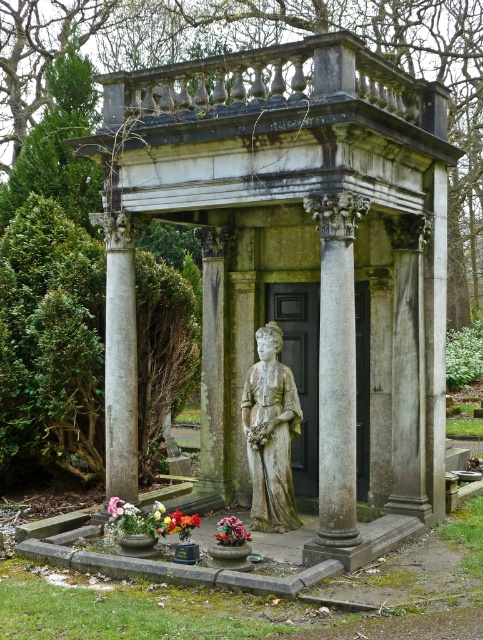
You are an architect examining the classical mausoleum. The mausoleum has a symmetrical design with columns. Where is the smooth stone column at center positioned in relation to the mausoleum?

The smooth stone column at center is positioned at point coordinates of 0.558 on the x and 0.248 on the y axis, which places it centrally within the mausoleum structure.